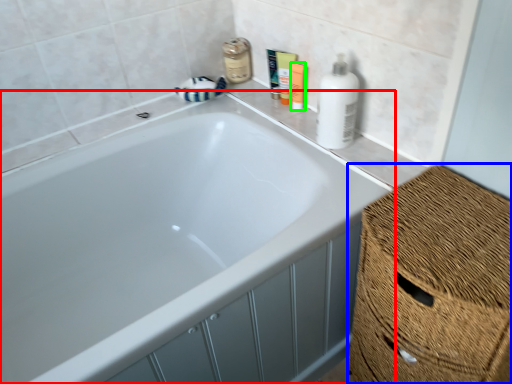
Question: Estimate the real-world distances between objects in this image. Which object is farther from bathtub (highlighted by a red box), basket (highlighted by a blue box) or toiletry (highlighted by a green box)?

Choices:
 (A) basket
 (B) toiletry

Answer: (B)